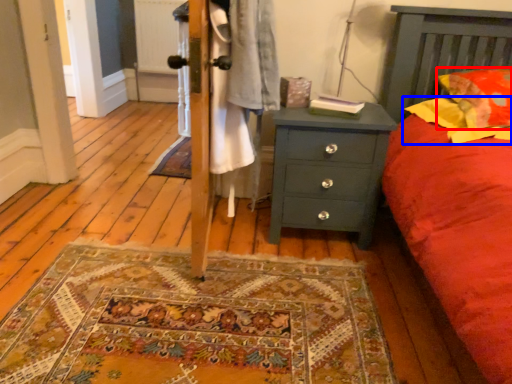
Question: Which of the following is the farthest to the observer, pillow (highlighted by a red box) or pillow (highlighted by a blue box)?

Choices:
 (A) pillow
 (B) pillow

Answer: (A)